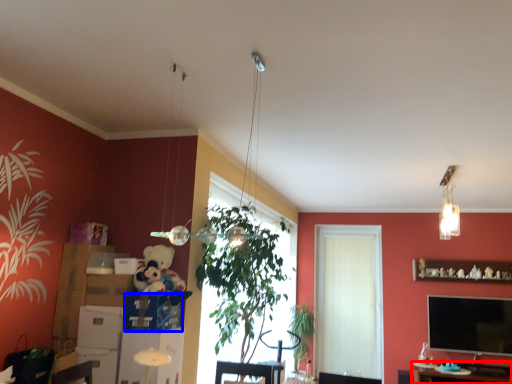
Question: Which object appears farthest to the camera in this image, table (highlighted by a red box) or cardboard box (highlighted by a blue box)?

Choices:
 (A) table
 (B) cardboard box

Answer: (A)